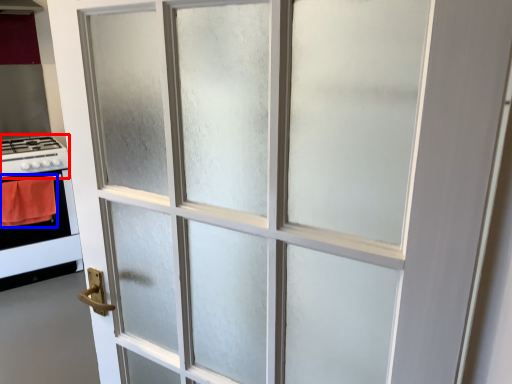
Question: Which object appears farthest to the camera in this image, gas stove (highlighted by a red box) or blanket (highlighted by a blue box)?

Choices:
 (A) gas stove
 (B) blanket

Answer: (A)